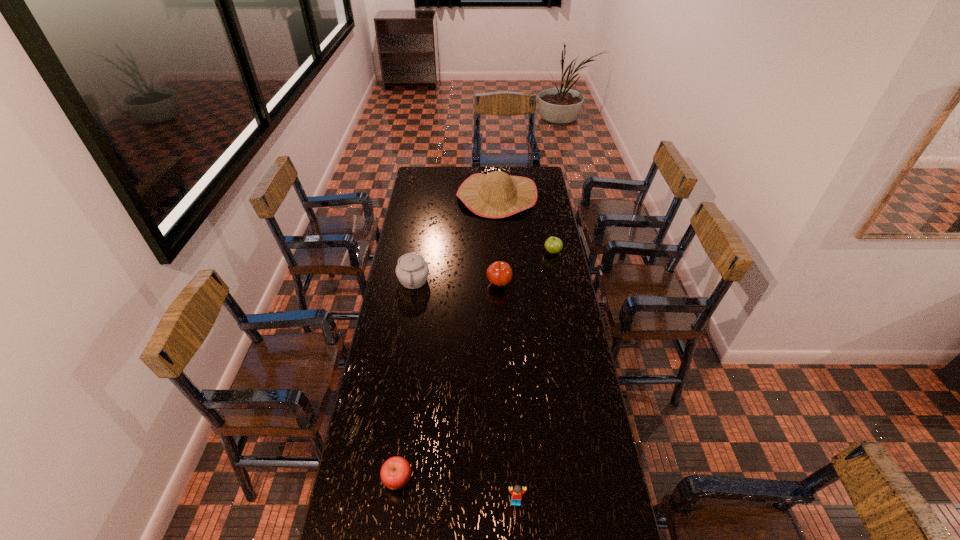
Identify the location of the farthest object. The height and width of the screenshot is (540, 960). (494, 195).

In order to click on chinaware in this screenshot , I will do `click(412, 271)`.

At what (x,y) coordinates should I click in order to perform the action: click on the second nearest apple. Please return your answer as a coordinate pair (x, y). The height and width of the screenshot is (540, 960). Looking at the image, I should click on (499, 273).

You are a GUI agent. You are given a task and a screenshot of the screen. Output one action in this format:
    pyautogui.click(x=<x>, y=<y>)
    Task: Click on the fourth shortest object
    
    Given the screenshot: What is the action you would take?
    pyautogui.click(x=499, y=273)

At what (x,y) coordinates should I click in order to perform the action: click on the farthest apple. Please return your answer as a coordinate pair (x, y). This screenshot has height=540, width=960. Looking at the image, I should click on (553, 245).

Identify the location of the fifth nearest object. (553, 245).

Find the location of a particular element. The width and height of the screenshot is (960, 540). Lego is located at coordinates (516, 492).

You are a GUI agent. You are given a task and a screenshot of the screen. Output one action in this format:
    pyautogui.click(x=<x>, y=<y>)
    Task: Click on the leftmost apple
    The height and width of the screenshot is (540, 960).
    Given the screenshot: What is the action you would take?
    pyautogui.click(x=395, y=473)

You are a GUI agent. You are given a task and a screenshot of the screen. Output one action in this format:
    pyautogui.click(x=<x>, y=<y>)
    Task: Click on the second nearest object
    The height and width of the screenshot is (540, 960).
    Given the screenshot: What is the action you would take?
    pyautogui.click(x=395, y=473)

The height and width of the screenshot is (540, 960). What are the coordinates of `free space located 0.220m on the left of the farthest object` in the screenshot? It's located at (418, 196).